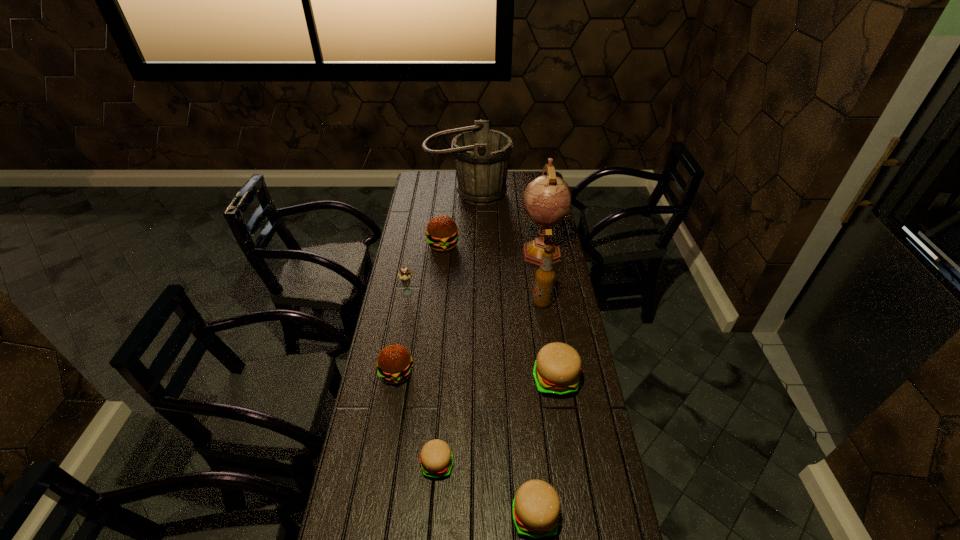
Locate an element on the screen. The width and height of the screenshot is (960, 540). vacant space at the right edge of the desktop is located at coordinates (555, 322).

I want to click on free region at the far left corner, so click(x=435, y=172).

Where is `free spot at the far right corner of the desktop`? Image resolution: width=960 pixels, height=540 pixels. free spot at the far right corner of the desktop is located at coordinates (540, 174).

The image size is (960, 540). Identify the location of vacant area that lies between the farthest hamburger and the smaller brown hamburger. (420, 309).

You are a GUI agent. You are given a task and a screenshot of the screen. Output one action in this format:
    pyautogui.click(x=<x>, y=<y>)
    Task: Click on the blank region between the smaller brown hamburger and the bucket
    The image size is (960, 540).
    Given the screenshot: What is the action you would take?
    pyautogui.click(x=432, y=283)

Where is `free area in between the bigger brown hamburger and the icecream`? free area in between the bigger brown hamburger and the icecream is located at coordinates (426, 268).

You are a GUI agent. You are given a task and a screenshot of the screen. Output one action in this format:
    pyautogui.click(x=<x>, y=<y>)
    Task: Click on the vacant space that is in between the farthest beige hamburger and the bucket
    The width and height of the screenshot is (960, 540).
    Given the screenshot: What is the action you would take?
    pyautogui.click(x=512, y=287)

Find the location of a particular element. vacant space in between the eighth shortest object and the biggest beige hamburger is located at coordinates (512, 287).

What are the coordinates of `empty space between the smaller brown hamburger and the icecream` in the screenshot? It's located at (403, 333).

Identify which object is the sixth closest to the tallest object. Please provide its 2D coordinates. Your answer should be formatted as a tuple, i.e. [(x, y)], where the tuple contains the x and y coordinates of a point satisfying the conditions above.

[(394, 362)]